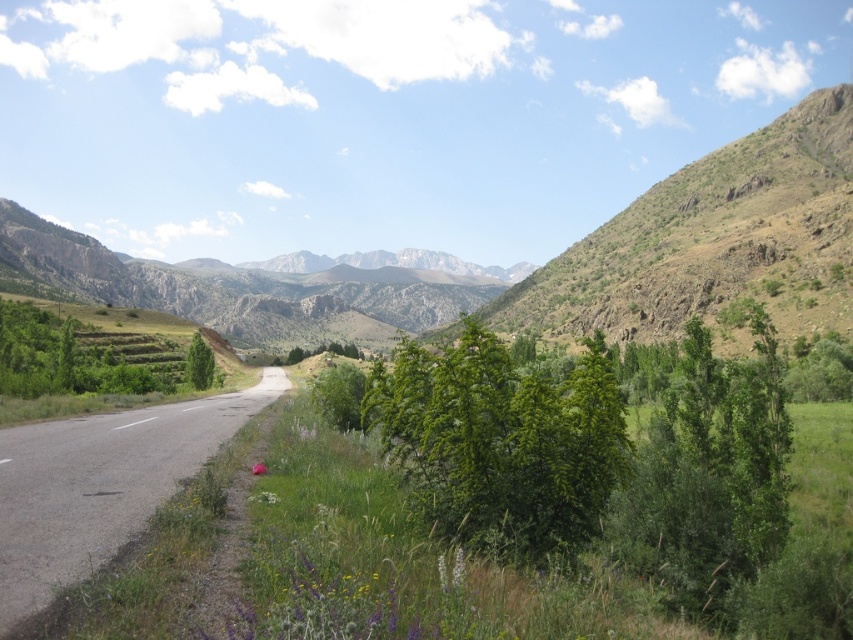
Question: Is green asphalt road at center to the left of green grassy mountain at center from the viewer's perspective?

Choices:
 (A) yes
 (B) no

Answer: (B)

Question: Which point is farther to the camera?

Choices:
 (A) (242, 280)
 (B) (15, 564)

Answer: (A)

Question: Does green asphalt road at center have a larger size compared to green grassy mountain at center?

Choices:
 (A) no
 (B) yes

Answer: (A)

Question: Does green asphalt road at center have a smaller size compared to green grassy mountain at center?

Choices:
 (A) yes
 (B) no

Answer: (A)